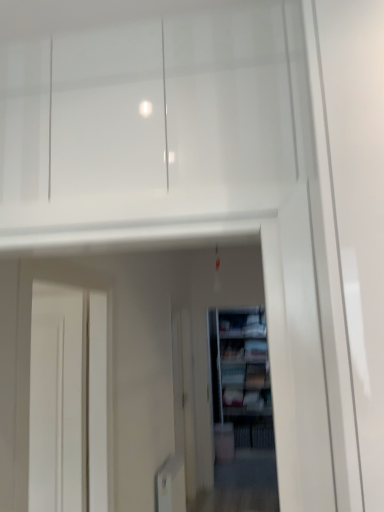
At what (x,y) coordinates should I click in order to perform the action: click on matte white cabinet at center. Please return your answer as a coordinate pair (x, y). This screenshot has width=384, height=512. Looking at the image, I should click on (242, 323).

What do you see at coordinates (242, 323) in the screenshot?
I see `matte white cabinet at center` at bounding box center [242, 323].

Locate an element on the screen. This screenshot has height=512, width=384. matte white cabinet at center is located at coordinates (242, 323).

Does point (215, 366) come closer to viewer compared to point (234, 335)?

Yes, it is in front of point (234, 335).

Is wooden bookshelf at center oriented towards matte white cabinet at center?

No, wooden bookshelf at center is not oriented towards matte white cabinet at center.

Considering the relative sizes of wooden bookshelf at center and matte white cabinet at center in the image provided, is wooden bookshelf at center thinner than matte white cabinet at center?

Indeed, wooden bookshelf at center has a lesser width compared to matte white cabinet at center.

Does matte white cabinet at center have a greater width compared to white glossy screen door at center?

Yes.

Between point (255, 335) and point (184, 415), which one is positioned in front?

The point (184, 415) is closer.

Is matte white cabinet at center facing away from white glossy screen door at center?

No, matte white cabinet at center's orientation is not away from white glossy screen door at center.

Looking at this image, between matte white cabinet at center and white glossy screen door at center, which one has larger size?

white glossy screen door at center is bigger.

Considering the sizes of objects matte white cabinet at center and wooden bookshelf at center in the image provided, who is bigger, matte white cabinet at center or wooden bookshelf at center?

wooden bookshelf at center is bigger.

Which is more to the right, matte white cabinet at center or wooden bookshelf at center?

From the viewer's perspective, matte white cabinet at center appears more on the right side.

From a real-world perspective, relative to white glossy screen door at center, is wooden bookshelf at center vertically above or below?

wooden bookshelf at center is situated higher than white glossy screen door at center in the real world.

From the image's perspective, which is below, wooden bookshelf at center or white glossy screen door at center?

wooden bookshelf at center appears lower in the image.

Which object is wider, wooden bookshelf at center or white glossy screen door at center?

white glossy screen door at center is wider.

From a real-world perspective, which object rests below the other?

white glossy screen door at center is physically lower.

Who is smaller, white glossy screen door at center or wooden bookshelf at center?

wooden bookshelf at center is smaller.

Is the depth of white glossy screen door at center less than that of wooden bookshelf at center?

Yes, white glossy screen door at center is in front of wooden bookshelf at center.

Is white glossy screen door at center looking in the opposite direction of wooden bookshelf at center?

No, white glossy screen door at center's orientation is not away from wooden bookshelf at center.

From the image's perspective, is white glossy screen door at center on matte white cabinet at center?

No, from the image's perspective, white glossy screen door at center is not on top of matte white cabinet at center.

Does point (181, 366) appear closer or farther from the camera than point (230, 327)?

Point (181, 366).

In the scene shown: Does white glossy screen door at center have a larger size compared to matte white cabinet at center?

Yes.

From a real-world perspective, is white glossy screen door at center positioned over matte white cabinet at center based on gravity?

No, from a real-world perspective, white glossy screen door at center is not over matte white cabinet at center

I want to click on shelf in front of the matte white cabinet at center, so click(x=242, y=376).

At what (x,y) coordinates should I click in order to perform the action: click on screen door lying below the matte white cabinet at center (from the image's perspective). Please return your answer as a coordinate pair (x, y). Looking at the image, I should click on (184, 396).

When comparing their distances from wooden bookshelf at center, does white glossy screen door at center or matte white cabinet at center seem further?

white glossy screen door at center is positioned further to the anchor wooden bookshelf at center.

Estimate the real-world distances between objects in this image. Which object is further from matte white cabinet at center, wooden bookshelf at center or white glossy screen door at center?

Among the two, white glossy screen door at center is located further to matte white cabinet at center.

Based on their spatial positions, is matte white cabinet at center or white glossy screen door at center closer to wooden bookshelf at center?

The object closer to wooden bookshelf at center is matte white cabinet at center.

From the image, which object appears to be nearer to matte white cabinet at center, white glossy screen door at center or wooden bookshelf at center?

wooden bookshelf at center.

Considering their positions, is wooden bookshelf at center positioned further to white glossy screen door at center than matte white cabinet at center?

matte white cabinet at center lies further to white glossy screen door at center than the other object.

Which object lies nearer to the anchor point white glossy screen door at center, matte white cabinet at center or wooden bookshelf at center?

wooden bookshelf at center is positioned closer to the anchor white glossy screen door at center.

The image size is (384, 512). I want to click on shelf between white glossy screen door at center and matte white cabinet at center in the front-back direction, so click(x=242, y=376).